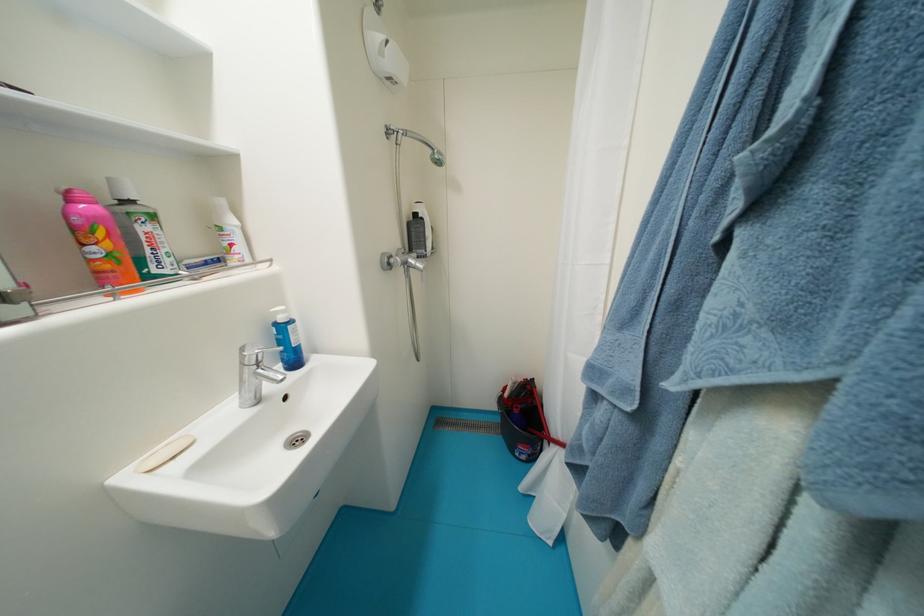
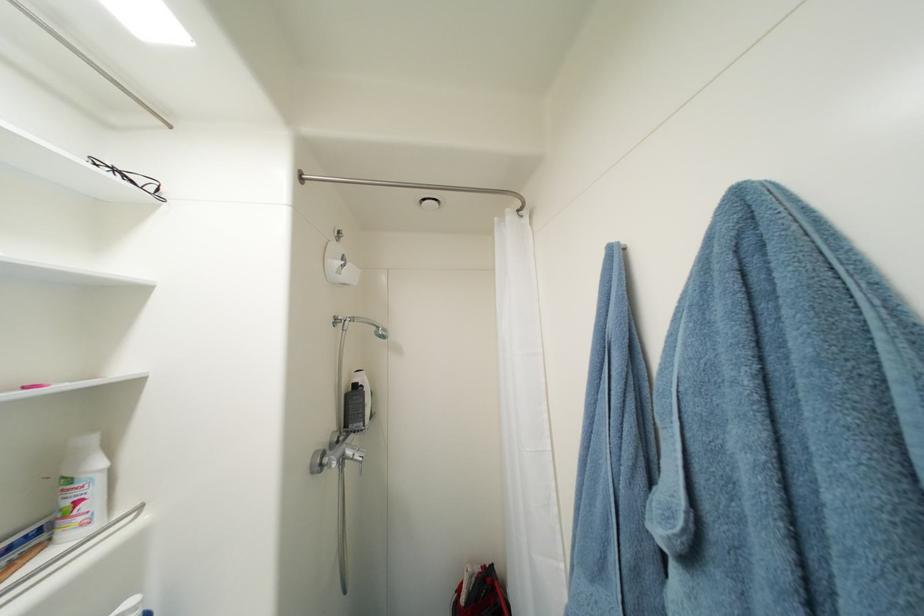
In the second image, find the point that corresponds to the point at 812,100 in the first image.

(691, 515)